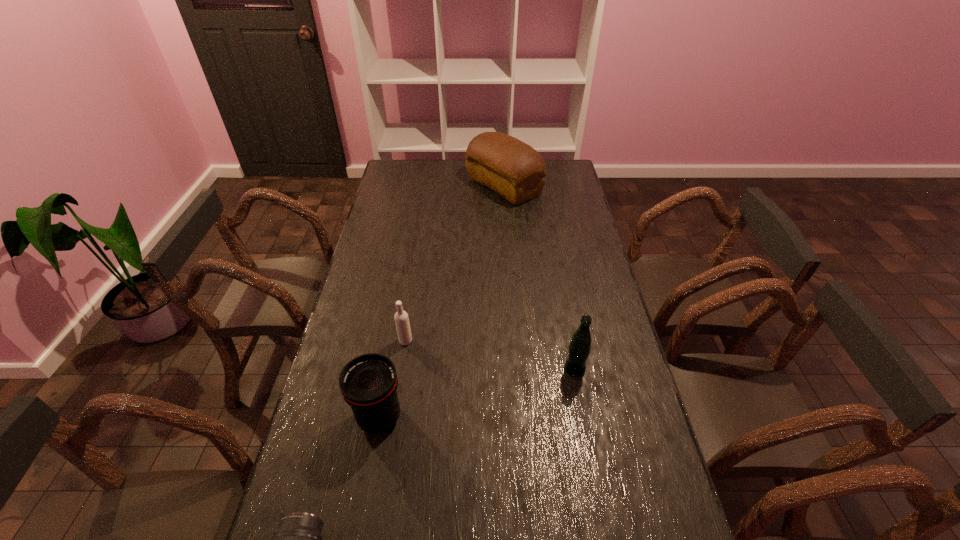
Locate an element on the screen. the farthest object is located at coordinates (513, 169).

Where is `the third nearest object`? This screenshot has height=540, width=960. the third nearest object is located at coordinates click(579, 348).

Where is `the second nearest object`? The image size is (960, 540). the second nearest object is located at coordinates (368, 383).

Where is `the taller telephoto lens`? This screenshot has width=960, height=540. the taller telephoto lens is located at coordinates (368, 383).

Find the location of a particular element. vodka is located at coordinates (401, 318).

The height and width of the screenshot is (540, 960). I want to click on vacant space located 0.260m on the left of the bread, so click(411, 186).

Find the location of `free space located on the back of the beer bottle`. free space located on the back of the beer bottle is located at coordinates (562, 298).

This screenshot has width=960, height=540. In order to click on free point located on the front of the fourth farthest object in this screenshot , I will do `click(360, 524)`.

The height and width of the screenshot is (540, 960). In order to click on vacant region located 0.160m on the right of the vodka in this screenshot , I will do `click(462, 341)`.

Where is `object that is at the far edge`? The height and width of the screenshot is (540, 960). object that is at the far edge is located at coordinates point(513,169).